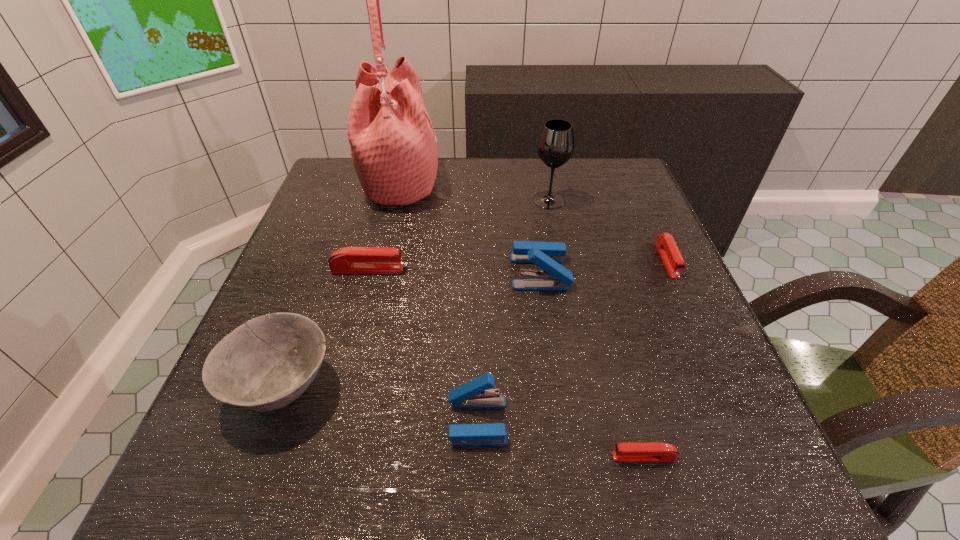
Identify the location of vacant area that lies between the bowl and the tallest object. Image resolution: width=960 pixels, height=540 pixels. (342, 285).

The height and width of the screenshot is (540, 960). I want to click on free space that is in between the left blue stapler and the second shortest stapler, so click(x=572, y=340).

In order to click on vacant space that's between the bowl and the left blue stapler in this screenshot , I will do `click(380, 403)`.

Find the location of a particular element. The image size is (960, 540). free spot between the wineglass and the rightmost red stapler is located at coordinates (608, 230).

This screenshot has width=960, height=540. Identify the location of vacant area that lies between the tallest object and the fourth object from left to right. (440, 302).

Locate an element on the screen. This screenshot has width=960, height=540. empty space that is in between the tallest object and the third stapler from right to left is located at coordinates (470, 227).

The image size is (960, 540). Identify the location of vacant space that is in between the third shortest stapler and the bowl. (325, 328).

Where is `object that is the seventh closest to the nearest stapler`? object that is the seventh closest to the nearest stapler is located at coordinates (393, 145).

Identify which object is the nearest to the third shortest object. Please provide its 2D coordinates. Your answer should be formatted as a tuple, i.e. [(x, y)], where the tuple contains the x and y coordinates of a point satisfying the conditions above.

[(265, 364)]

At what (x,y) coordinates should I click in order to perform the action: click on the second closest stapler relative to the seventh shortest object. Please return your answer as a coordinate pair (x, y). Image resolution: width=960 pixels, height=540 pixels. Looking at the image, I should click on (665, 243).